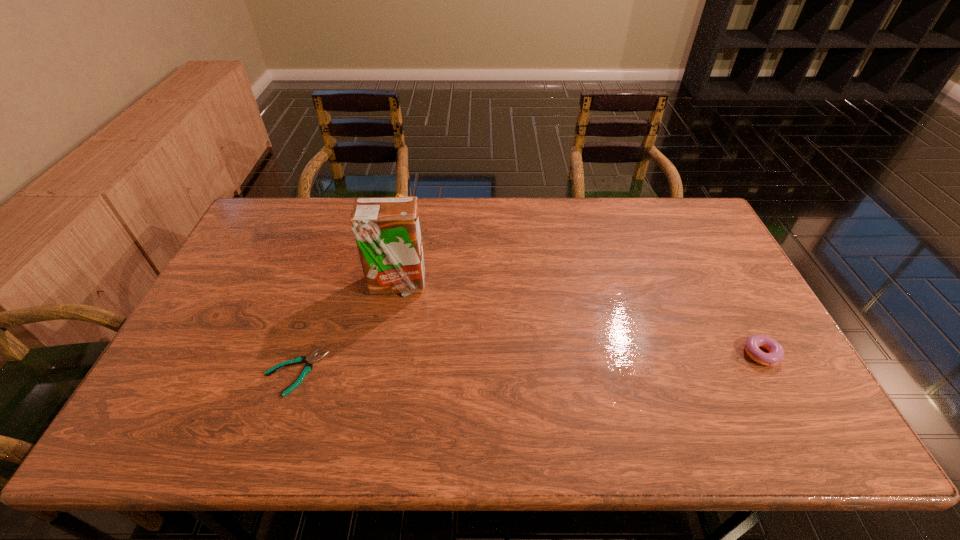
What are the coordinates of `object that is positioned at the near right corner` in the screenshot? It's located at (776, 352).

You are a GUI agent. You are given a task and a screenshot of the screen. Output one action in this format:
    pyautogui.click(x=<x>, y=<y>)
    Task: Click on the free region at the far edge of the desktop
    The height and width of the screenshot is (540, 960).
    Given the screenshot: What is the action you would take?
    pyautogui.click(x=555, y=227)

In the image, there is a desktop. Find the location of `vacant space at the near edge`. vacant space at the near edge is located at coordinates (677, 380).

Find the location of a particular element. The width and height of the screenshot is (960, 540). free location at the left edge is located at coordinates (220, 373).

I want to click on free space at the right edge of the desktop, so click(x=728, y=357).

In the image, there is a desktop. What are the coordinates of `vacant space at the far left corner` in the screenshot? It's located at (275, 228).

In order to click on free space at the near left corner of the desktop in this screenshot , I will do `click(179, 406)`.

The width and height of the screenshot is (960, 540). Find the location of `vacant space in between the rightmost object and the shortest object`. vacant space in between the rightmost object and the shortest object is located at coordinates point(529,364).

Find the location of a particular element. The width and height of the screenshot is (960, 540). blank region between the third shortest object and the doughnut is located at coordinates (583, 289).

This screenshot has width=960, height=540. What are the coordinates of `free space that is in between the rightmost object and the tallest object` in the screenshot? It's located at (580, 320).